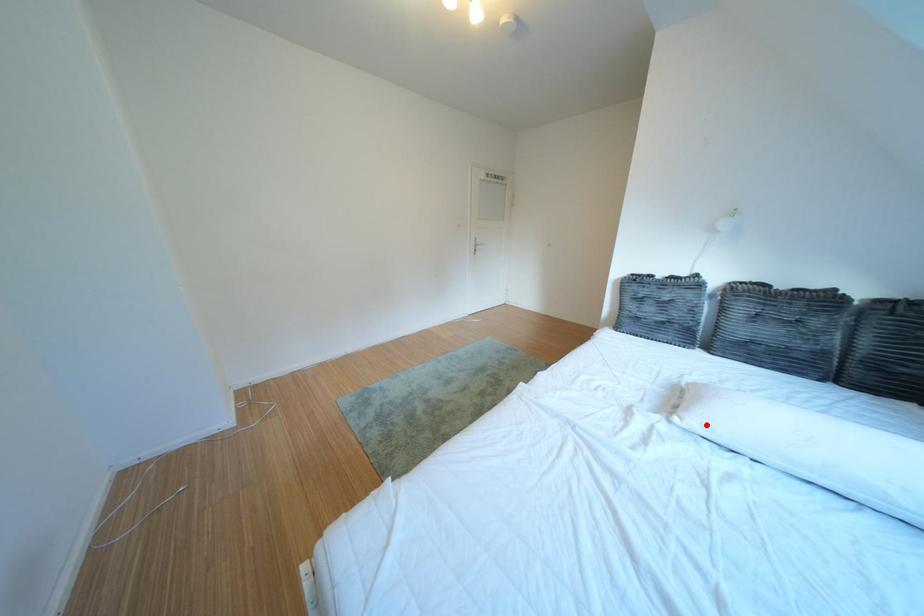
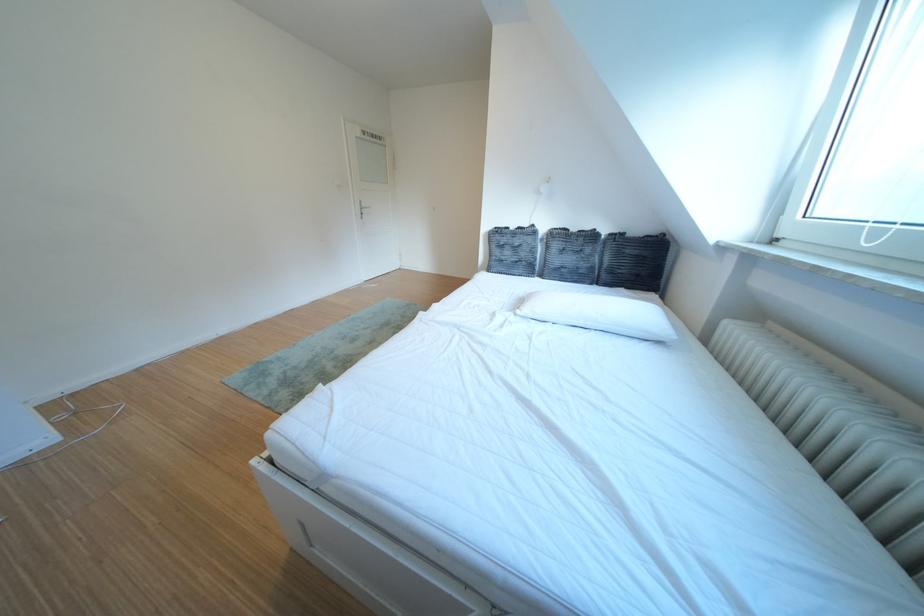
In the second image, find the point that corresponds to the highlighted location in the first image.

(540, 314)